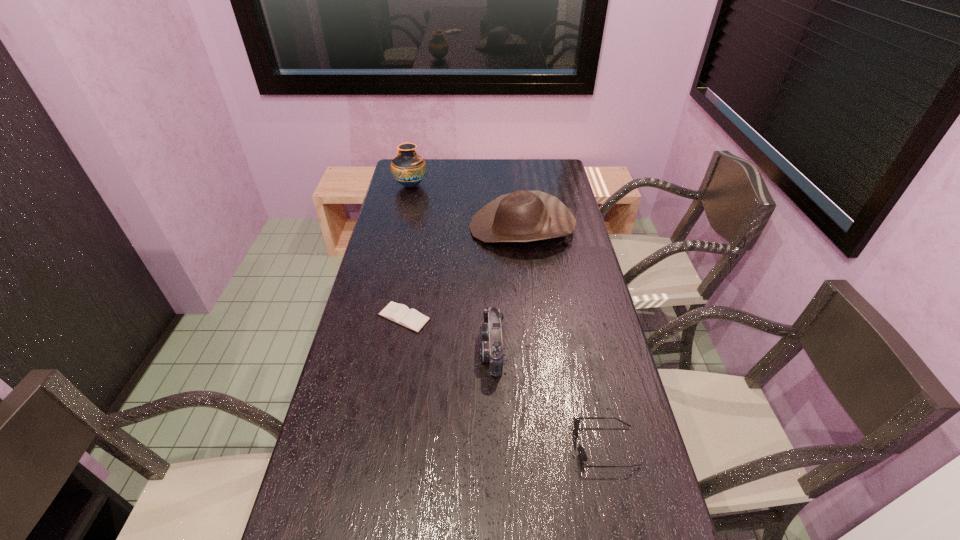
The height and width of the screenshot is (540, 960). In order to click on the tallest object in this screenshot , I will do `click(408, 168)`.

In order to click on pottery in this screenshot , I will do `click(408, 168)`.

Locate an element on the screen. This screenshot has height=540, width=960. the fourth shortest object is located at coordinates (522, 216).

The width and height of the screenshot is (960, 540). Find the location of `cowboy hat`. cowboy hat is located at coordinates (522, 216).

In order to click on the third tallest object in this screenshot , I will do `click(491, 343)`.

Where is `sunglasses`? Image resolution: width=960 pixels, height=540 pixels. sunglasses is located at coordinates (582, 455).

At what (x,y) coordinates should I click in order to perform the action: click on the fourth tallest object. Please return your answer as a coordinate pair (x, y). Looking at the image, I should click on (582, 455).

At what (x,y) coordinates should I click in order to perform the action: click on the shortest object. Please return your answer as a coordinate pair (x, y). The image size is (960, 540). Looking at the image, I should click on (400, 314).

The width and height of the screenshot is (960, 540). I want to click on free point located 0.290m on the front of the tallest object, so click(399, 235).

The image size is (960, 540). Identify the location of vacant space located on the back of the cowboy hat. (517, 187).